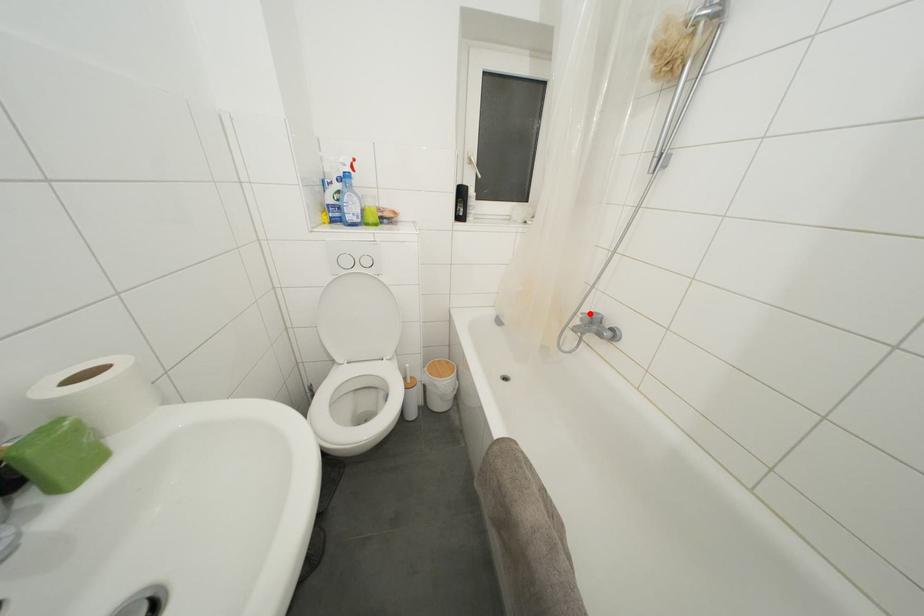
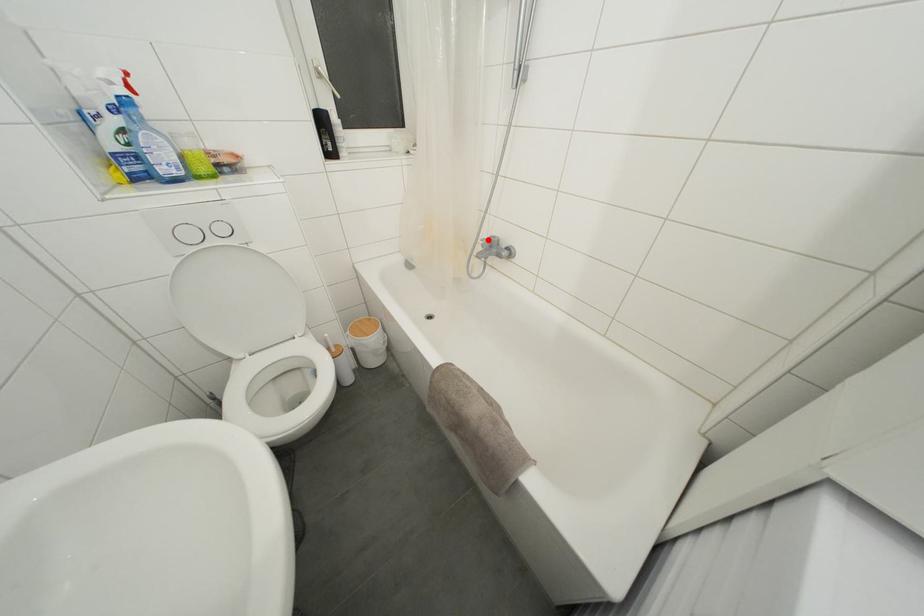
Looking at this image, I am providing you with two images of the same scene from different viewpoints. A red point is marked on the first image and another point is marked on the second image. Are the points marked in image1 and image2 representing the same 3D position?

Yes